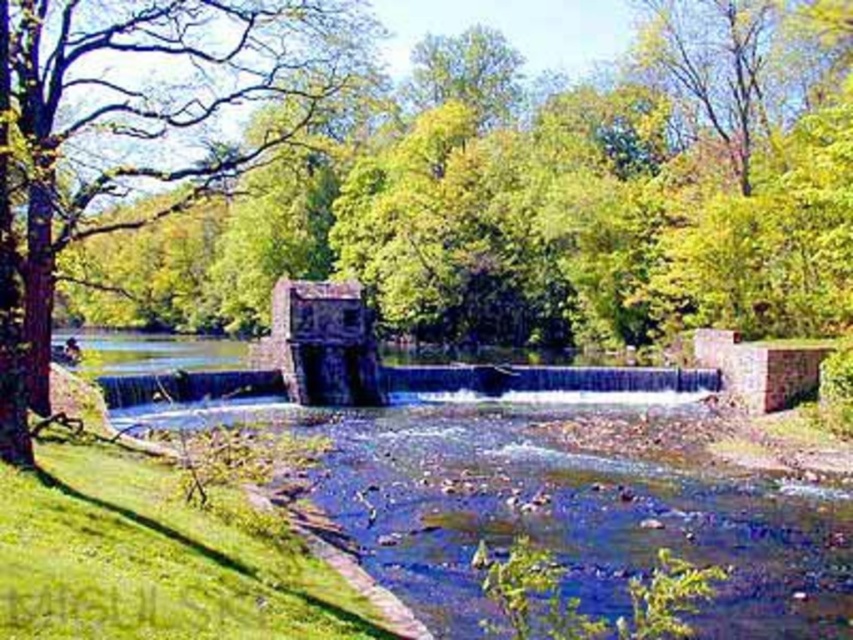
You are a hiker standing at the edge of the river and see the green leafy tree at center and the green leafy tree at left. Which tree would you need to look up higher to see the top of?

The green leafy tree at center is taller than the green leafy tree at left, so you would need to look up higher to see the top of the green leafy tree at center.

You are planning to take a photo of the green leafy tree at center and the green leafy tree at left from a spot where both are visible. Which tree should you focus on if you want to capture the wider tree in your shot?

The green leafy tree at center is wider than the green leafy tree at left, so you should focus on the green leafy tree at center to capture the wider tree in your shot.